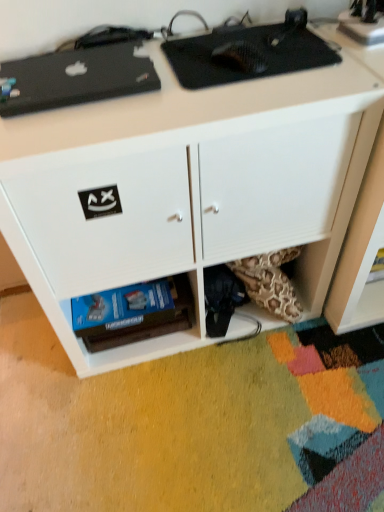
You are a GUI agent. You are given a task and a screenshot of the screen. Output one action in this format:
    pyautogui.click(x=<x>, y=<y>)
    Task: Click on the vacant space that's between black matte laptop at upper left, the third appliance positioned from the right, and black carbon fiber mouse pad at upper center, the second appliance in the right-to-left sequence
    Image resolution: width=384 pixels, height=512 pixels.
    Given the screenshot: What is the action you would take?
    pyautogui.click(x=157, y=72)